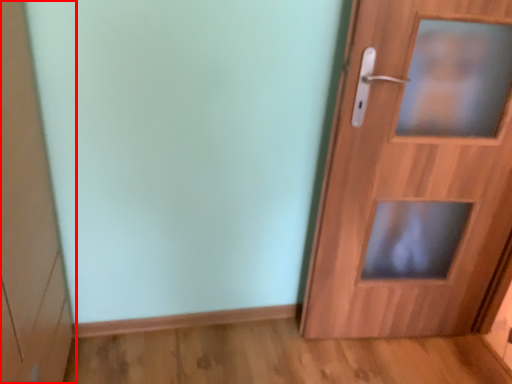
Question: Observing the image, what is the correct spatial positioning of cabinetry (annotated by the red box) in reference to door?

Choices:
 (A) left
 (B) right

Answer: (A)